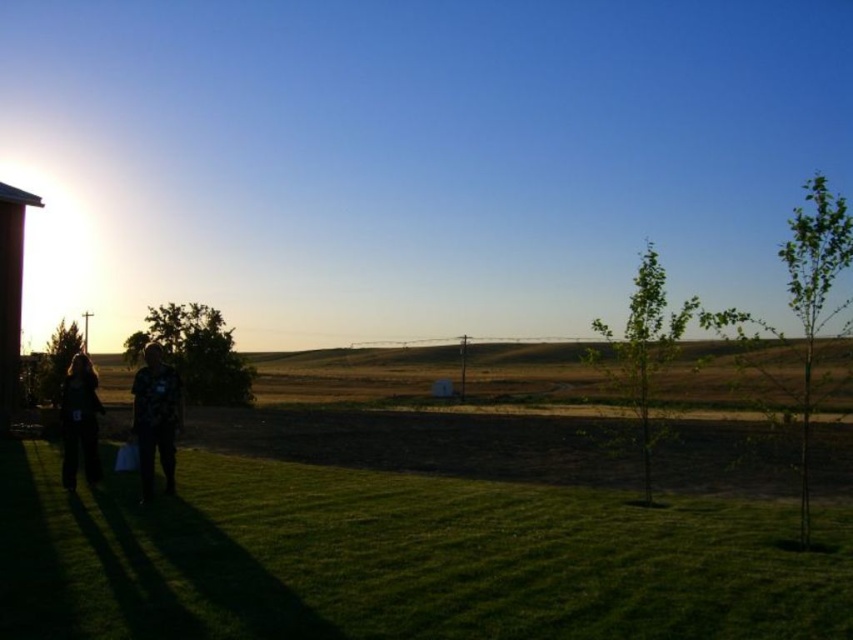
You are a photographer trying to capture the scene from the same angle. You notice two people in dark clothing at the lower left of the image. Which one is closer to the camera, the dark clothing couple at lower left or the dark clothing figure at lower left?

The dark clothing couple at lower left is positioned over the dark clothing figure at lower left, meaning the couple is closer to the camera.

You are a photographer trying to capture a photo of the dark clothing couple at lower left and the dark clothing figure at lower left. According to the scene, which one is closer to you so that you can focus on them first?

The dark clothing couple at lower left is in front of dark clothing figure at lower left, so the dark clothing couple at lower left is closer to you and should be focused on first.